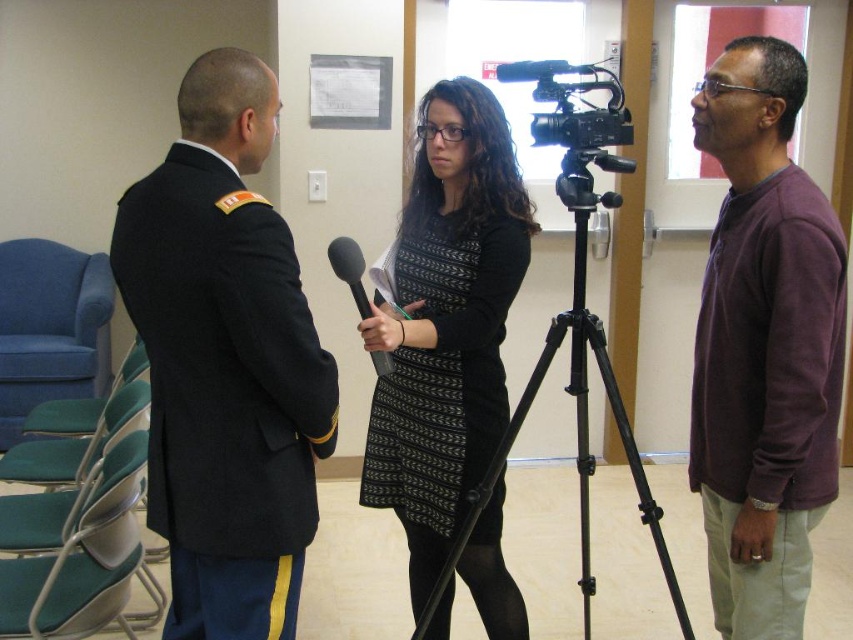
Is point (370, 429) in front of point (349, 273)?

No, (370, 429) is behind (349, 273).

Which is in front, point (509, 163) or point (347, 280)?

Point (347, 280)

What do you see at coordinates (445, 323) in the screenshot? The image size is (853, 640). I see `black textured dress at center` at bounding box center [445, 323].

I want to click on black textured dress at center, so click(445, 323).

Is the position of black woolen jacket at left less distant than that of purple matte shirt at right?

Answer: Yes, it is in front of purple matte shirt at right.

Looking at this image, which is below, black woolen jacket at left or purple matte shirt at right?

black woolen jacket at left is below.

Find the location of `black woolen jacket at left`. black woolen jacket at left is located at coordinates (224, 394).

Is the position of black woolen jacket at left more distant than that of black textured dress at center?

No, it is not.

Does black woolen jacket at left have a smaller size compared to black textured dress at center?

Indeed, black woolen jacket at left has a smaller size compared to black textured dress at center.

Identify the location of black woolen jacket at left. (224, 394).